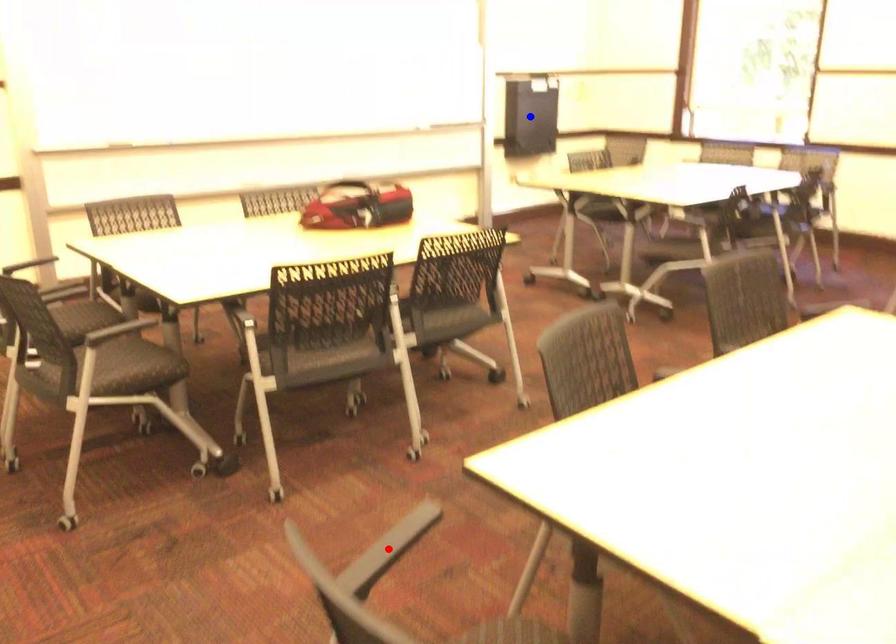
Question: Which of the two points in the image is closer to the camera?

Choices:
 (A) Blue point is closer.
 (B) Red point is closer.

Answer: (B)